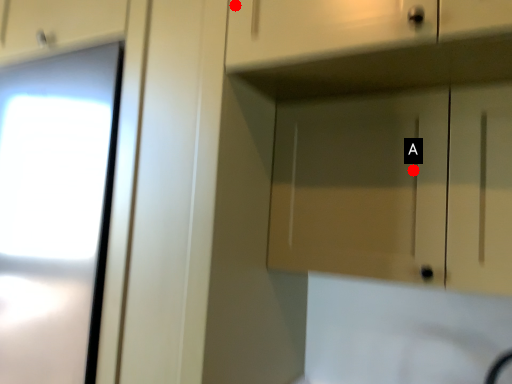
Question: Two points are circled on the image, labeled by A and B beside each circle. Which of the following is the farthest from the observer?

Choices:
 (A) A is further
 (B) B is further

Answer: (A)